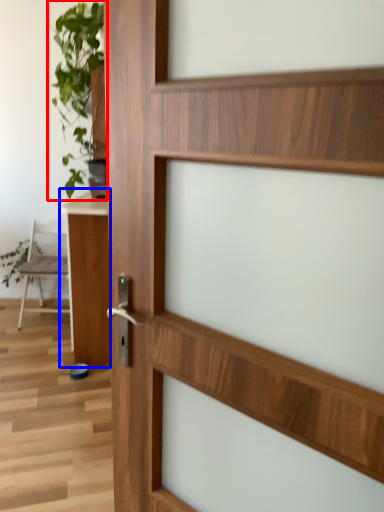
Question: Which point is closer to the camera, houseplant (highlighted by a red box) or table (highlighted by a blue box)?

Choices:
 (A) houseplant
 (B) table

Answer: (B)